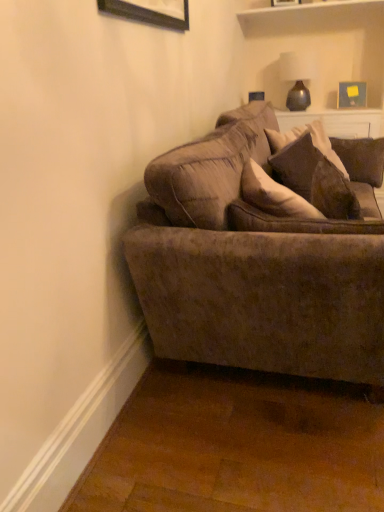
Question: Is wooden picture frame at upper right, which is the 2th picture frame in front-to-back order, placed right next to matte brown vase at upper right?

Choices:
 (A) no
 (B) yes

Answer: (A)

Question: Is wooden picture frame at upper right, acting as the second picture frame starting from the top, not near matte brown vase at upper right?

Choices:
 (A) no
 (B) yes

Answer: (A)

Question: Is wooden picture frame at upper right, which is the 2th picture frame in front-to-back order, taller than matte brown vase at upper right?

Choices:
 (A) yes
 (B) no

Answer: (B)

Question: Does wooden picture frame at upper right, which is the 2th picture frame in front-to-back order, come behind matte brown vase at upper right?

Choices:
 (A) yes
 (B) no

Answer: (A)

Question: Is wooden picture frame at upper right, which is counted as the second picture frame, starting from the left, to the right of matte brown vase at upper right from the viewer's perspective?

Choices:
 (A) no
 (B) yes

Answer: (B)

Question: From the image's perspective, is wooden picture frame at upper right, which is counted as the second picture frame, starting from the left, beneath matte brown vase at upper right?

Choices:
 (A) yes
 (B) no

Answer: (A)

Question: Is matte brown vase at upper right smaller than velvet brown couch at center?

Choices:
 (A) yes
 (B) no

Answer: (A)

Question: Can you confirm if matte brown vase at upper right is positioned to the right of velvet brown couch at center?

Choices:
 (A) no
 (B) yes

Answer: (B)

Question: From the image's perspective, is matte brown vase at upper right on velvet brown couch at center?

Choices:
 (A) yes
 (B) no

Answer: (A)

Question: Is the depth of matte brown vase at upper right less than that of velvet brown couch at center?

Choices:
 (A) no
 (B) yes

Answer: (A)

Question: Is matte brown vase at upper right thinner than velvet brown couch at center?

Choices:
 (A) yes
 (B) no

Answer: (A)

Question: Does matte brown vase at upper right have a greater height compared to velvet brown couch at center?

Choices:
 (A) no
 (B) yes

Answer: (A)

Question: Does velvet brown couch at center lie behind wooden picture frame at upper center, placed as the 2th picture frame when sorted from back to front?

Choices:
 (A) no
 (B) yes

Answer: (A)